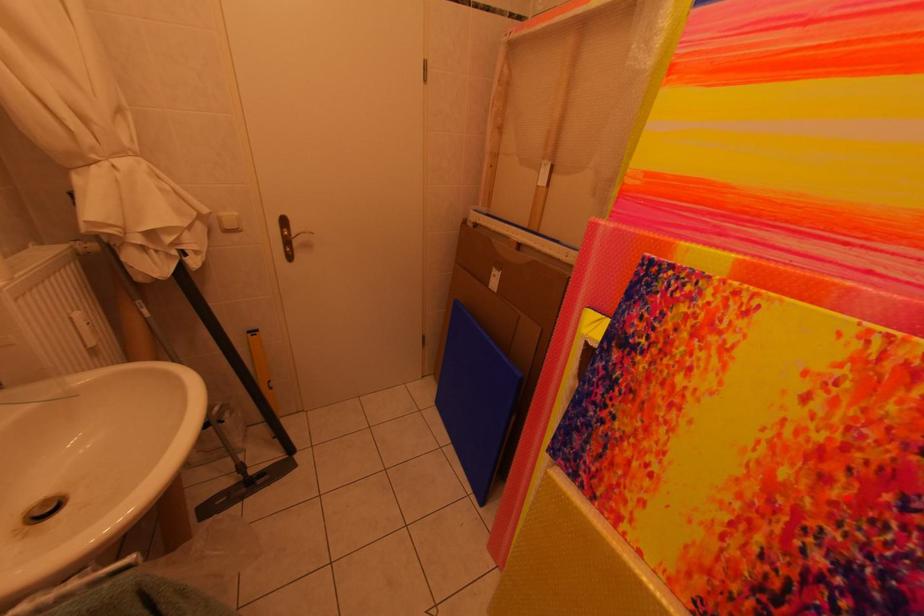
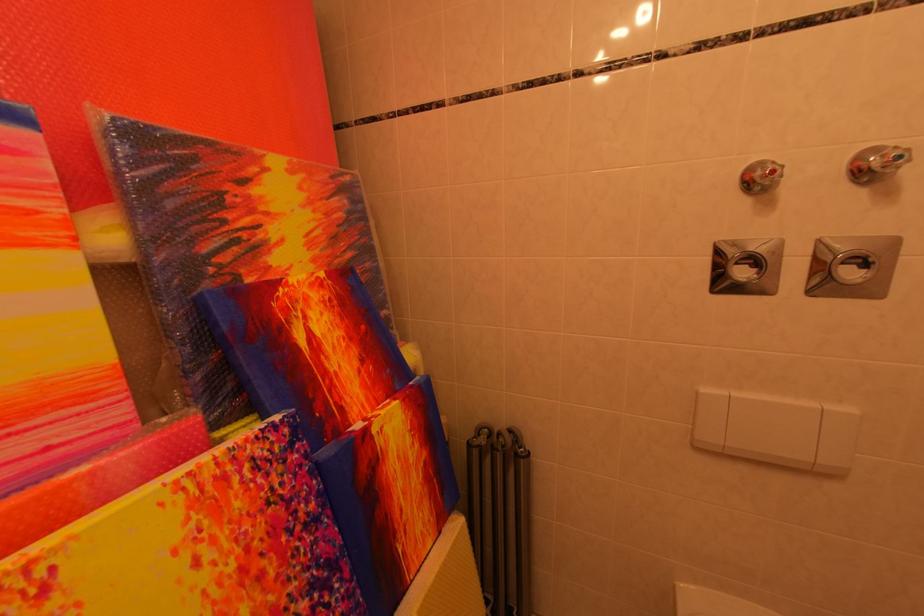
In the second image, find the point that corresponds to the highlighted location in the first image.

(281, 575)